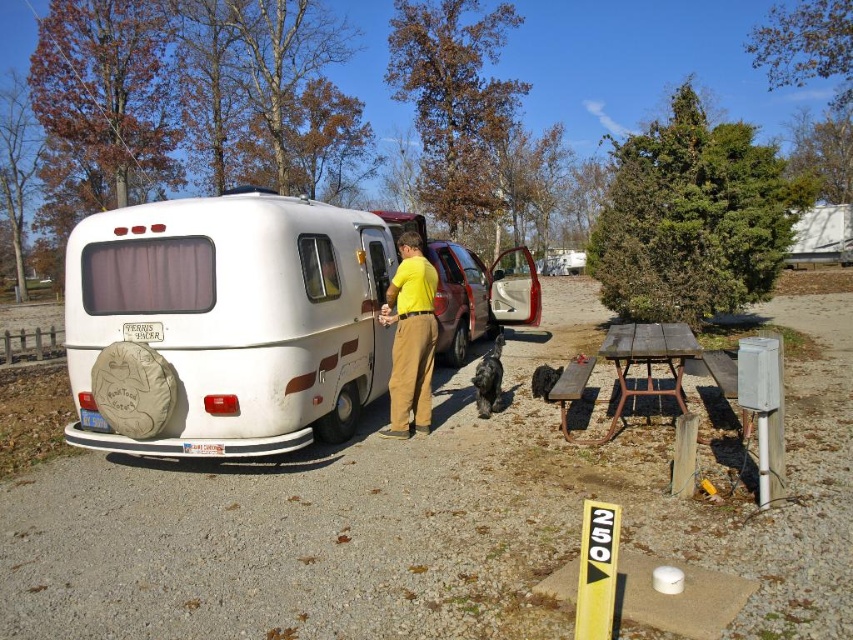
Does white matte van at center have a larger size compared to yellow cotton shirt at center?

Yes, white matte van at center is bigger than yellow cotton shirt at center.

Consider the image. Who is more distant from viewer, (184, 234) or (386, 435)?

The point (386, 435) is more distant.

Where is `white matte van at center`? white matte van at center is located at coordinates (231, 320).

Is yellow cotton shirt at center shorter than weathered wood picnic table at lower right?

No, yellow cotton shirt at center is not shorter than weathered wood picnic table at lower right.

At what (x,y) coordinates should I click in order to perform the action: click on yellow cotton shirt at center. Please return your answer as a coordinate pair (x, y). Looking at the image, I should click on (410, 337).

Find the location of a particular element. Image resolution: width=853 pixels, height=640 pixels. yellow cotton shirt at center is located at coordinates (410, 337).

Is white matte van at center above weathered wood picnic table at lower right?

Correct, white matte van at center is located above weathered wood picnic table at lower right.

Which is more to the left, white matte van at center or weathered wood picnic table at lower right?

Positioned to the left is white matte van at center.

Does point (314, 230) come farther from viewer compared to point (657, 388)?

No, it is in front of (657, 388).

Where is `white matte van at center`? white matte van at center is located at coordinates (231, 320).